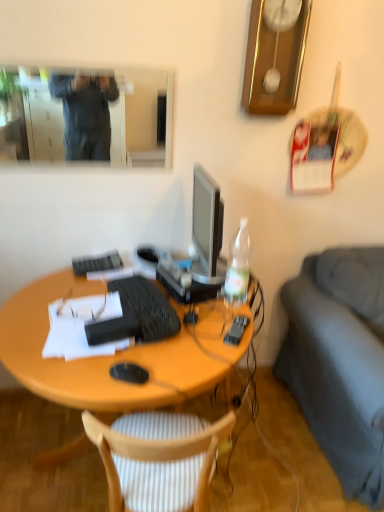
Where is `free spot behind black matte computer mouse at center`? The image size is (384, 512). free spot behind black matte computer mouse at center is located at coordinates click(x=152, y=349).